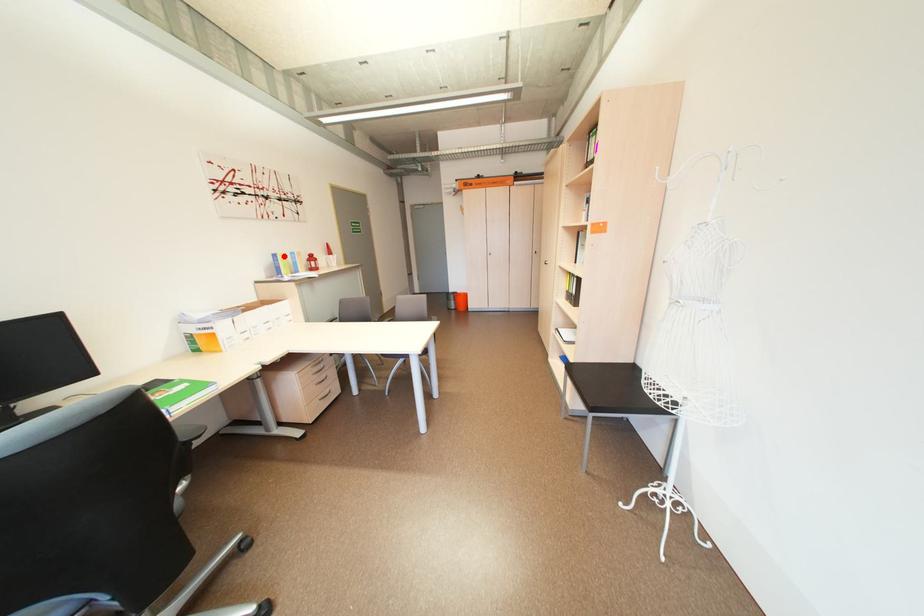
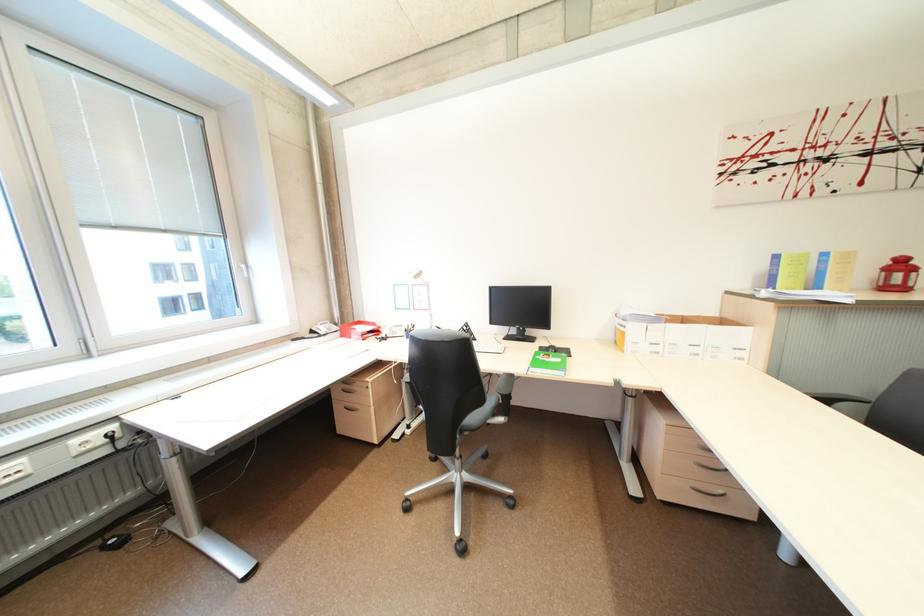
The point at the highlighted location is marked in the first image. Where is the corresponding point in the second image?

(785, 257)